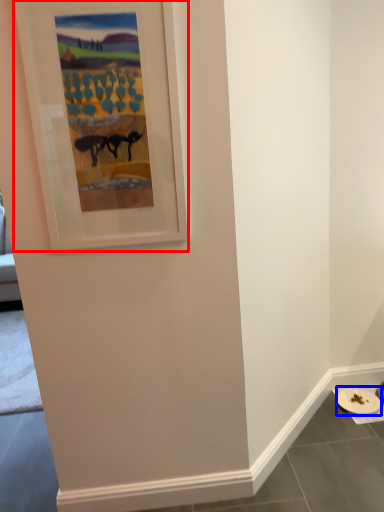
Question: Which object appears closest to the camera in this image, picture frame (highlighted by a red box) or platter (highlighted by a blue box)?

Choices:
 (A) picture frame
 (B) platter

Answer: (A)